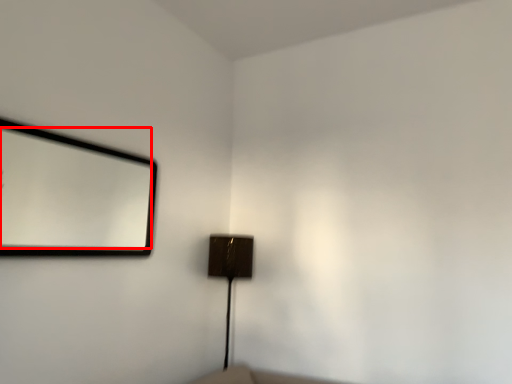
Question: Where is mirror (annotated by the red box) located in relation to lamp in the image?

Choices:
 (A) left
 (B) right

Answer: (A)